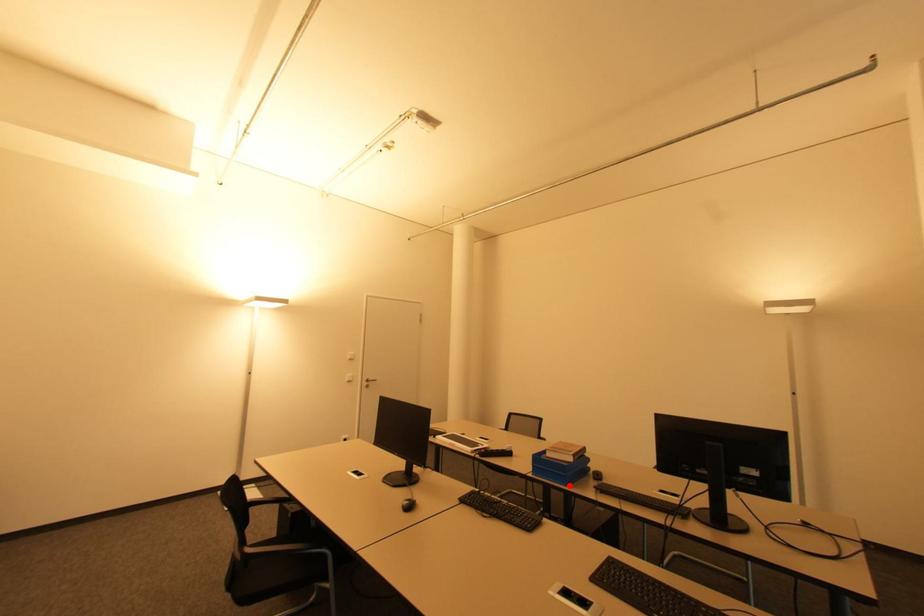
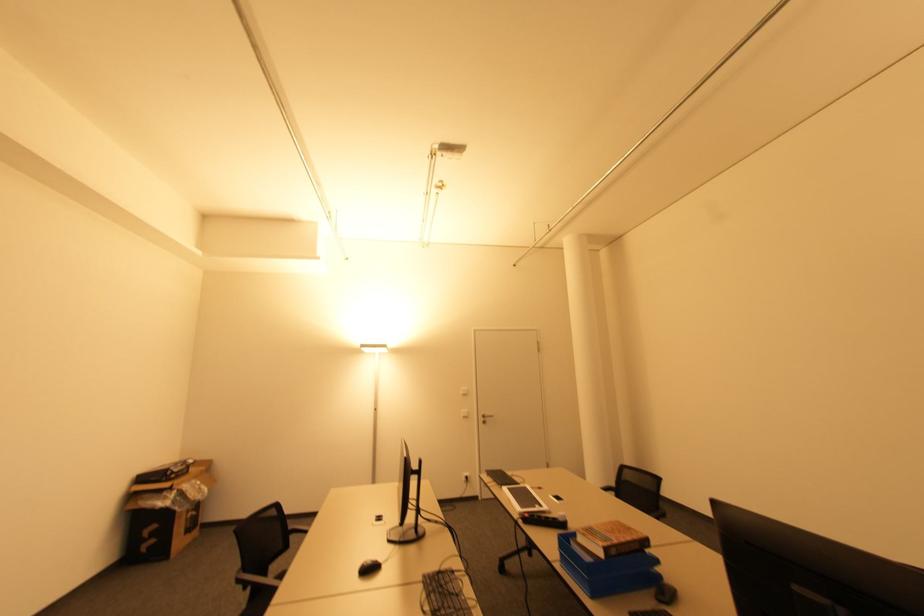
Where in the second image is the point corresponding to the highlighted location from the first image?

(594, 597)